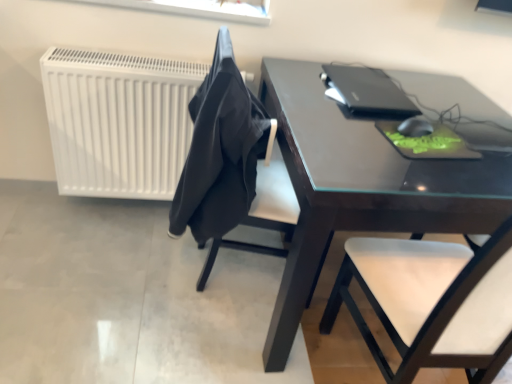
Question: From a real-world perspective, is white matte radiator at left below dark brown glossy table at center?

Choices:
 (A) no
 (B) yes

Answer: (A)

Question: Is white matte radiator at left behind dark brown glossy table at center?

Choices:
 (A) yes
 (B) no

Answer: (A)

Question: Considering the relative positions of white matte radiator at left and dark brown glossy table at center in the image provided, is white matte radiator at left to the left of dark brown glossy table at center from the viewer's perspective?

Choices:
 (A) yes
 (B) no

Answer: (A)

Question: Considering the relative sizes of white matte radiator at left and dark brown glossy table at center in the image provided, is white matte radiator at left wider than dark brown glossy table at center?

Choices:
 (A) yes
 (B) no

Answer: (B)

Question: Is white matte radiator at left far from dark brown glossy table at center?

Choices:
 (A) no
 (B) yes

Answer: (A)

Question: From the image's perspective, relative to white matte radiator at left, is black matte mouse at upper right above or below?

Choices:
 (A) below
 (B) above

Answer: (A)

Question: Based on their sizes in the image, would you say black matte mouse at upper right is bigger or smaller than white matte radiator at left?

Choices:
 (A) small
 (B) big

Answer: (A)

Question: In terms of height, does black matte mouse at upper right look taller or shorter compared to white matte radiator at left?

Choices:
 (A) tall
 (B) short

Answer: (B)

Question: In the image, is black matte mouse at upper right positioned in front of or behind white matte radiator at left?

Choices:
 (A) front
 (B) behind

Answer: (A)

Question: Considering the positions of dark brown glossy table at center and white matte radiator at left in the image, is dark brown glossy table at center bigger or smaller than white matte radiator at left?

Choices:
 (A) small
 (B) big

Answer: (B)

Question: In the image, is dark brown glossy table at center positioned in front of or behind white matte radiator at left?

Choices:
 (A) front
 (B) behind

Answer: (A)

Question: Is dark brown glossy table at center wider or thinner than white matte radiator at left?

Choices:
 (A) wide
 (B) thin

Answer: (A)

Question: From the image's perspective, is dark brown glossy table at center above or below white matte radiator at left?

Choices:
 (A) below
 (B) above

Answer: (A)

Question: Is black fabric at center wider or thinner than dark brown glossy table at center?

Choices:
 (A) thin
 (B) wide

Answer: (A)

Question: Which is correct: black fabric at center is inside dark brown glossy table at center, or outside of it?

Choices:
 (A) outside
 (B) inside

Answer: (A)